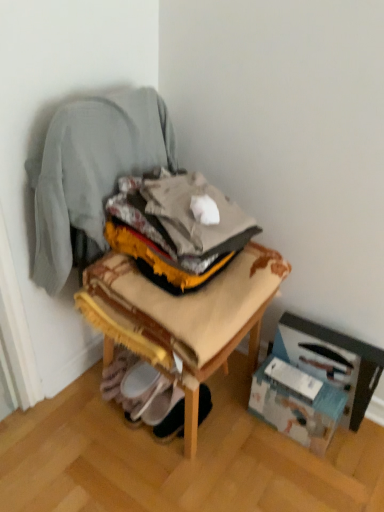
Locate an element on the screen. The height and width of the screenshot is (512, 384). white fabric shoe at lower center is located at coordinates (171, 423).

Is point (273, 356) more distant than point (361, 362)?

Yes, it is.

From the picture: Is teal cardboard box at lower right, positioned as the 1th cardboard box in left-to-right order, thinner than white cardboard box at lower right, which appears as the first cardboard box when viewed from the right?

In fact, teal cardboard box at lower right, positioned as the 1th cardboard box in left-to-right order, might be wider than white cardboard box at lower right, which appears as the first cardboard box when viewed from the right.

Is teal cardboard box at lower right, positioned as the 1th cardboard box in left-to-right order, aimed at white cardboard box at lower right, which appears as the first cardboard box when viewed from the right?

No.

This screenshot has height=512, width=384. In order to click on cardboard box above the teal cardboard box at lower right, which is the 2th cardboard box in right-to-left order (from a real-world perspective) in this screenshot , I will do `click(332, 361)`.

Can you confirm if wooden chair at center is positioned to the right of wooden stool at center?

In fact, wooden chair at center is to the left of wooden stool at center.

Is the surface of wooden chair at center in direct contact with wooden stool at center?

Yes, wooden chair at center and wooden stool at center clearly make contact.

Where is `chair on the left of the wooden stool at center`? The image size is (384, 512). chair on the left of the wooden stool at center is located at coordinates (186, 295).

Which object is closer to the camera taking this photo, wooden chair at center or wooden stool at center?

wooden chair at center is more forward.

Does wooden chair at center have a lesser height compared to white fabric shoe at lower center?

In fact, wooden chair at center may be taller than white fabric shoe at lower center.

Is wooden chair at center positioned in front of white fabric shoe at lower center?

Yes, the depth of wooden chair at center is less than that of white fabric shoe at lower center.

From a real-world perspective, which is physically above, wooden chair at center or white fabric shoe at lower center?

In real-world perspective, wooden chair at center is above.

Is wooden chair at center far away from white fabric shoe at lower center?

No, wooden chair at center is in close proximity to white fabric shoe at lower center.

Which is more to the right, teal cardboard box at lower right, positioned as the 1th cardboard box in left-to-right order, or wooden chair at center?

From the viewer's perspective, teal cardboard box at lower right, positioned as the 1th cardboard box in left-to-right order, appears more on the right side.

Who is taller, teal cardboard box at lower right, which is the 2th cardboard box in right-to-left order, or wooden chair at center?

wooden chair at center.

Which object is more forward, teal cardboard box at lower right, positioned as the 1th cardboard box in left-to-right order, or wooden chair at center?

wooden chair at center.

From the image's perspective, which object appears higher, teal cardboard box at lower right, which is the 2th cardboard box in right-to-left order, or wooden chair at center?

wooden chair at center, from the image's perspective.

Is point (118, 339) less distant than point (372, 372)?

Yes, point (118, 339) is in front of point (372, 372).

Is wooden chair at center far away from white cardboard box at lower right, marked as the 2th cardboard box in a left-to-right arrangement?

Actually, wooden chair at center and white cardboard box at lower right, marked as the 2th cardboard box in a left-to-right arrangement, are a little close together.

Can you confirm if wooden chair at center is positioned to the right of white cardboard box at lower right, marked as the 2th cardboard box in a left-to-right arrangement?

In fact, wooden chair at center is to the left of white cardboard box at lower right, marked as the 2th cardboard box in a left-to-right arrangement.

Is wooden stool at center to the left of white fabric shoe at lower center from the viewer's perspective?

Incorrect, wooden stool at center is not on the left side of white fabric shoe at lower center.

Based on the photo, is white fabric shoe at lower center surrounded by wooden stool at center?

No, wooden stool at center does not contain white fabric shoe at lower center.

What's the angular difference between wooden stool at center and white fabric shoe at lower center's facing directions?

The angular difference between wooden stool at center and white fabric shoe at lower center is 89.2 degrees.

Is wooden stool at center shorter than white fabric shoe at lower center?

No, wooden stool at center is not shorter than white fabric shoe at lower center.

Which object is positioned more to the left, white cardboard box at lower right, which appears as the first cardboard box when viewed from the right, or white fabric shoe at lower center?

white fabric shoe at lower center.

How much distance is there between white cardboard box at lower right, which appears as the first cardboard box when viewed from the right, and white fabric shoe at lower center?

They are 17.71 inches apart.

Is white cardboard box at lower right, which appears as the first cardboard box when viewed from the right, with white fabric shoe at lower center?

white cardboard box at lower right, which appears as the first cardboard box when viewed from the right, and white fabric shoe at lower center are not in contact.

Between white cardboard box at lower right, which appears as the first cardboard box when viewed from the right, and white fabric shoe at lower center, which one is positioned behind?

white fabric shoe at lower center is further away from the camera.

Find the location of a particular element. cardboard box above the teal cardboard box at lower right, positioned as the 1th cardboard box in left-to-right order (from a real-world perspective) is located at coordinates (332, 361).

The height and width of the screenshot is (512, 384). Identify the location of furniture lying behind the wooden chair at center. click(182, 317).

Based on their spatial positions, is white cardboard box at lower right, marked as the 2th cardboard box in a left-to-right arrangement, or white fabric shoe at lower center further from teal cardboard box at lower right, positioned as the 1th cardboard box in left-to-right order?

white fabric shoe at lower center.

From the image, which object appears to be nearer to wooden stool at center, white cardboard box at lower right, which appears as the first cardboard box when viewed from the right, or wooden chair at center?

wooden chair at center is positioned closer to the anchor wooden stool at center.

Looking at the image, which one is located closer to white fabric shoe at lower center, wooden stool at center or wooden chair at center?

Among the two, wooden stool at center is located nearer to white fabric shoe at lower center.

From the image, which object appears to be farther from teal cardboard box at lower right, positioned as the 1th cardboard box in left-to-right order, white cardboard box at lower right, marked as the 2th cardboard box in a left-to-right arrangement, or wooden chair at center?

wooden chair at center is positioned further to the anchor teal cardboard box at lower right, positioned as the 1th cardboard box in left-to-right order.

Considering their positions, is wooden chair at center positioned closer to teal cardboard box at lower right, positioned as the 1th cardboard box in left-to-right order, than white cardboard box at lower right, which appears as the first cardboard box when viewed from the right?

The object closer to teal cardboard box at lower right, positioned as the 1th cardboard box in left-to-right order, is white cardboard box at lower right, which appears as the first cardboard box when viewed from the right.

Which object lies nearer to the anchor point wooden stool at center, white fabric shoe at lower center or teal cardboard box at lower right, which is the 2th cardboard box in right-to-left order?

teal cardboard box at lower right, which is the 2th cardboard box in right-to-left order.

Considering their positions, is wooden stool at center positioned further to wooden chair at center than white cardboard box at lower right, marked as the 2th cardboard box in a left-to-right arrangement?

white cardboard box at lower right, marked as the 2th cardboard box in a left-to-right arrangement, is further to wooden chair at center.

Estimate the real-world distances between objects in this image. Which object is further from wooden chair at center, teal cardboard box at lower right, which is the 2th cardboard box in right-to-left order, or wooden stool at center?

The object further to wooden chair at center is teal cardboard box at lower right, which is the 2th cardboard box in right-to-left order.

This screenshot has width=384, height=512. In order to click on furniture between wooden chair at center and white cardboard box at lower right, which appears as the first cardboard box when viewed from the right, in the front-back direction in this screenshot , I will do `click(182, 317)`.

You are a GUI agent. You are given a task and a screenshot of the screen. Output one action in this format:
    pyautogui.click(x=<x>, y=<y>)
    Task: Click on the cardboard box between wooden chair at center and teal cardboard box at lower right, positioned as the 1th cardboard box in left-to-right order, from front to back
    The height and width of the screenshot is (512, 384).
    Given the screenshot: What is the action you would take?
    pyautogui.click(x=332, y=361)

Identify the location of furniture between white fabric shoe at lower center and white cardboard box at lower right, which appears as the first cardboard box when viewed from the right. (182, 317).

You are a GUI agent. You are given a task and a screenshot of the screen. Output one action in this format:
    pyautogui.click(x=<x>, y=<y>)
    Task: Click on the cardboard box between wooden stool at center and white cardboard box at lower right, which appears as the first cardboard box when viewed from the right, in the horizontal direction
    The height and width of the screenshot is (512, 384).
    Given the screenshot: What is the action you would take?
    pyautogui.click(x=297, y=403)